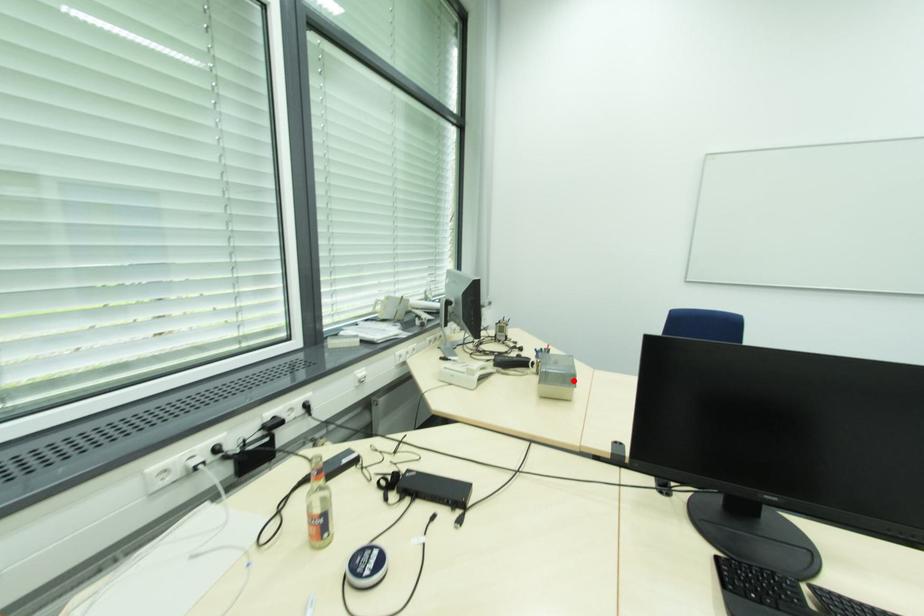
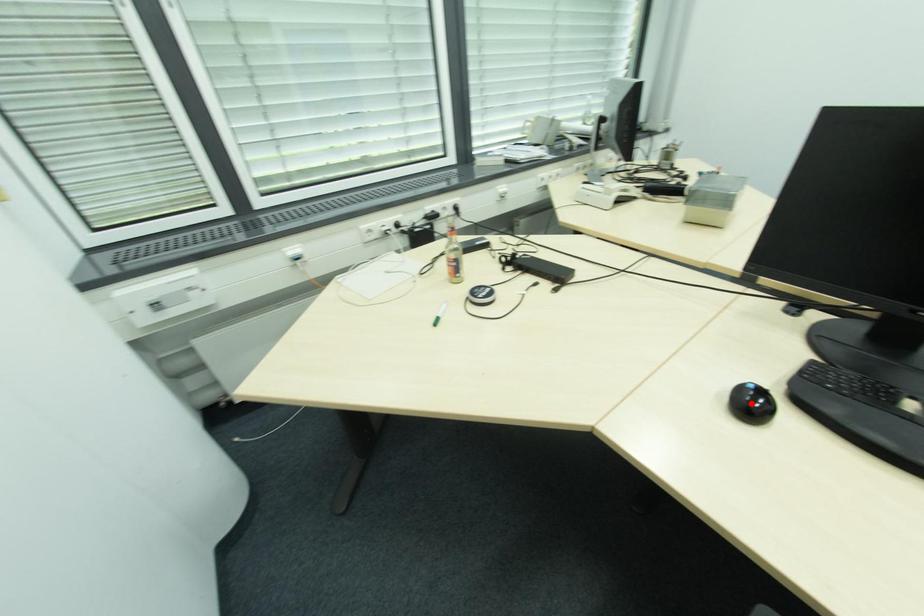
I am providing you with two images of the same scene from different viewpoints. A red point is marked on the first image and another point is marked on the second image. Are the points marked in image1 and image2 representing the same 3D position?

No